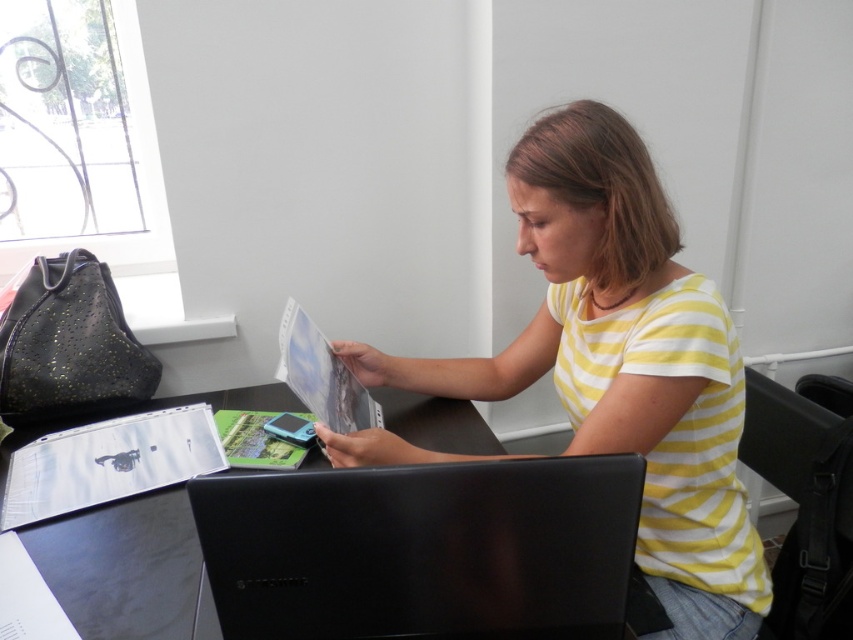
Identify the location of yellow striped shirt at center. (624, 362).

Between yellow striped shirt at center and black plastic laptop at center, which one appears on the right side from the viewer's perspective?

yellow striped shirt at center is more to the right.

Find the location of a particular element. yellow striped shirt at center is located at coordinates (x=624, y=362).

Does black plastic table at center lie behind black plastic laptop at center?

No, it is in front of black plastic laptop at center.

Based on the photo, is black plastic table at center closer to the viewer compared to black plastic laptop at center?

Yes.

This screenshot has width=853, height=640. I want to click on black plastic table at center, so click(x=355, y=554).

Can you confirm if black plastic table at center is wider than yellow striped shirt at center?

Yes.

Which is more to the left, black plastic table at center or yellow striped shirt at center?

Positioned to the left is black plastic table at center.

Is point (577, 524) in front of point (708, 468)?

Yes, it is in front of point (708, 468).

Identify the location of black plastic table at center. (355, 554).